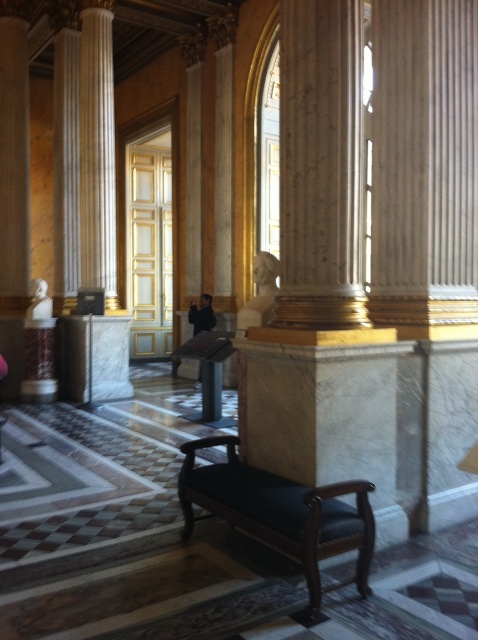
Consider the image. You are a visitor standing at the entrance of the room. You want to sit down on the dark wood bench at center. Which direction should you walk relative to the white marble bust at left?

The dark wood bench at center is positioned on the right side of the white marble bust at left. Therefore, to reach the bench, you should walk to the right side of the white marble bust at left.

You are standing in the grand hall and want to know how far the point at coordinates (x=82, y=92) is from you. Can you determine the distance?

The point at coordinates (x=82, y=92) is 9.57 meters away from the viewer.

From the picture: You are a visitor standing in the grand hall and want to sit down. The dark wood bench at center and the white marble bust at left are both in sight. Which object is taller and thus more suitable for sitting?

The dark wood bench at center is taller than the white marble bust at left, making it more suitable for sitting.